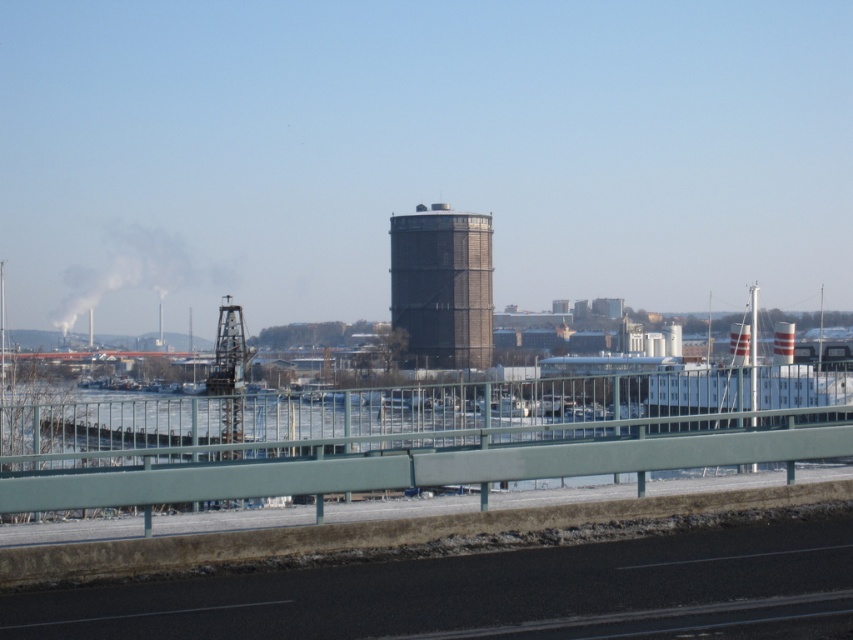
Between green metal railing at lower center and smoketransparent at left, which one has less height?

green metal railing at lower center is shorter.

What are the coordinates of `green metal railing at lower center` in the screenshot? It's located at (422, 440).

Where is `green metal railing at lower center`? Image resolution: width=853 pixels, height=640 pixels. green metal railing at lower center is located at coordinates (422, 440).

Does dark gray metallic silo at center appear over smoketransparent at left?

No.

Consider the image. Is dark gray metallic silo at center smaller than smoketransparent at left?

Yes, dark gray metallic silo at center is smaller than smoketransparent at left.

The height and width of the screenshot is (640, 853). I want to click on dark gray metallic silo at center, so click(442, 285).

Locate an element on the screen. This screenshot has width=853, height=640. dark gray metallic silo at center is located at coordinates (x=442, y=285).

Based on the photo, is black asphalt highway at lower center to the right of smoketransparent at left from the viewer's perspective?

Indeed, black asphalt highway at lower center is positioned on the right side of smoketransparent at left.

Does black asphalt highway at lower center have a greater width compared to smoketransparent at left?

In fact, black asphalt highway at lower center might be narrower than smoketransparent at left.

Does point (572, 593) lie behind point (165, 241)?

No, it is not.

At what (x,y) coordinates should I click in order to perform the action: click on black asphalt highway at lower center. Please return your answer as a coordinate pair (x, y). Looking at the image, I should click on [490, 593].